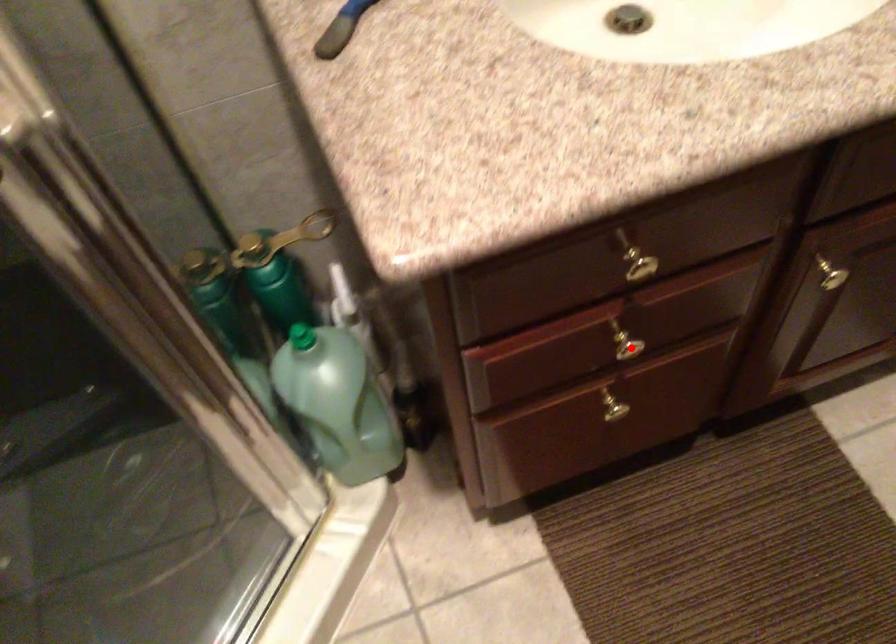
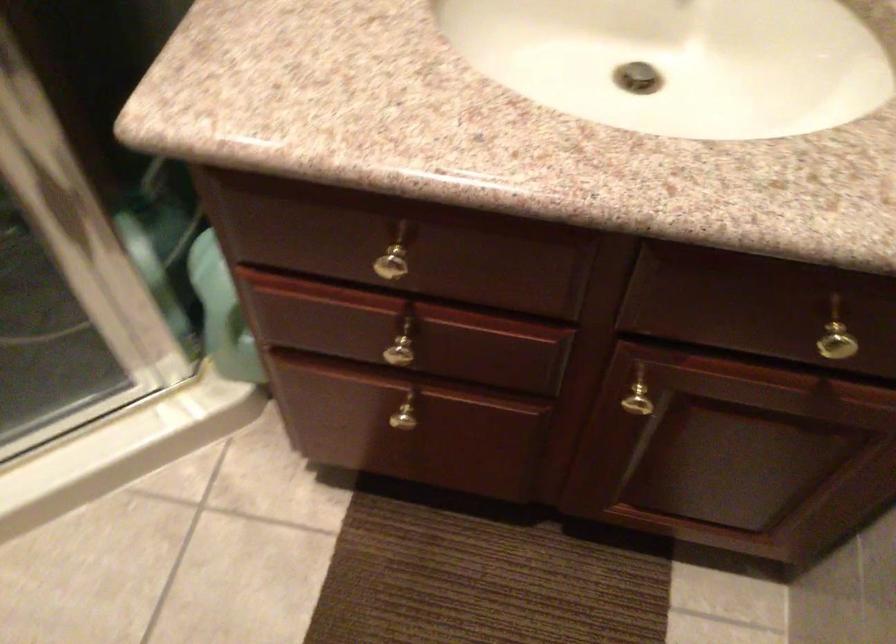
The point at the highlighted location is marked in the first image. Where is the corresponding point in the second image?

(401, 354)